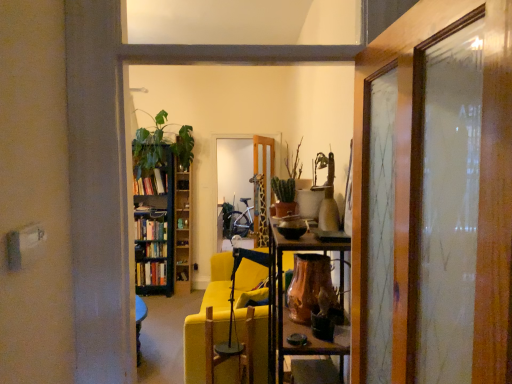
Question: Looking at their shapes, would you say hardcover books at left, the 2th book ordered from the bottom, is wider or thinner than green matte bookcase at left?

Choices:
 (A) thin
 (B) wide

Answer: (A)

Question: Is point [152, 188] closer or farther from the camera than point [146, 244]?

Choices:
 (A) farther
 (B) closer

Answer: (B)

Question: Which object is positioned farthest from the copper metallic vase at center?

Choices:
 (A) green matte cactus at center, which is the first houseplant in front-to-back order
 (B) wooden bookshelf at left
 (C) glossy wooden door at center
 (D) hardcover books at left, which is the 2th book from top to bottom
 (E) wooden swivel chair at center

Answer: (D)

Question: Which object is the farthest from the glossy wooden door at center?

Choices:
 (A) green matte cactus at center, which is counted as the third houseplant, starting from the back
 (B) green matte bookcase at left
 (C) metallic yellow chair at center
 (D) hardcover books at left, which ranks as the 1th book in bottom-to-top order
 (E) wooden swivel chair at center

Answer: (D)